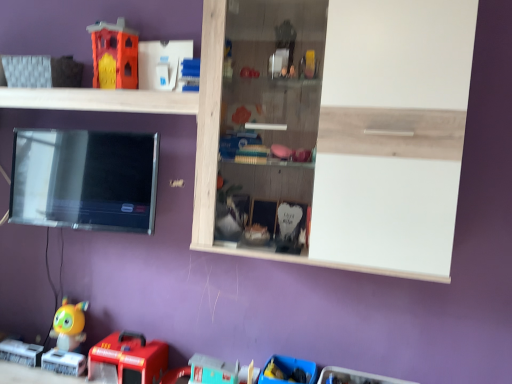
Question: Which is correct: yellow matte toy at lower left, the 2th toy from the top, is inside orange matte fire station at upper left, which is the 3th toy from right to left, or outside of it?

Choices:
 (A) outside
 (B) inside

Answer: (A)

Question: Does point (64, 307) appear closer or farther from the camera than point (116, 86)?

Choices:
 (A) closer
 (B) farther

Answer: (B)

Question: Which is nearer to the orange matte fire station at upper left, the 2th toy from the left?

Choices:
 (A) rubberized red fire truck at lower left, the second toy from the right
 (B) wooden cabinet at upper center, positioned as the first shelf in right-to-left order
 (C) blue plastic toy at lower center, which ranks as the 1th toy in right-to-left order
 (D) yellow matte toy at lower left, the 1th toy viewed from the left
 (E) white wood shelf at upper center, which is the second shelf in right-to-left order

Answer: (E)

Question: Which object is the closest to the white wood shelf at upper center, arranged as the first shelf when viewed from the left?

Choices:
 (A) wooden cabinet at upper center, positioned as the first shelf in right-to-left order
 (B) blue plastic toy at lower center, the first toy in the bottom-to-top sequence
 (C) rubberized red fire truck at lower left, the second toy from the right
 (D) yellow matte toy at lower left, the 1th toy viewed from the left
 (E) orange matte fire station at upper left, which appears as the first toy when viewed from the top

Answer: (E)